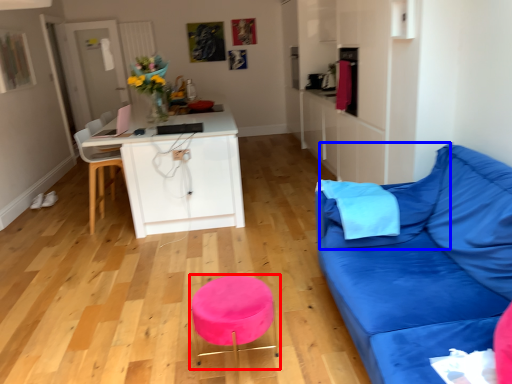
Question: Which point is further to the camera, bar stool (highlighted by a red box) or pillow (highlighted by a blue box)?

Choices:
 (A) bar stool
 (B) pillow

Answer: (B)